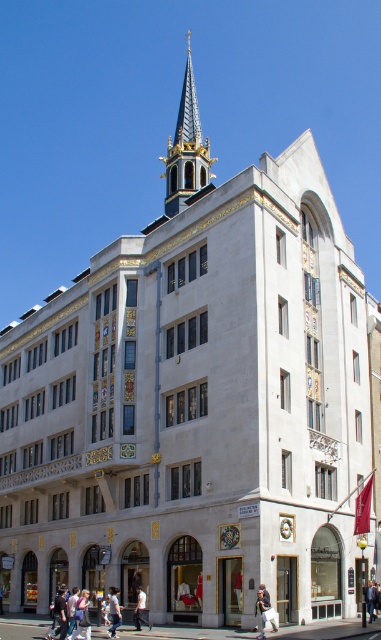
Question: Does gold textured clock at center have a smaller size compared to light brown leather jacket at lower center?

Choices:
 (A) no
 (B) yes

Answer: (B)

Question: Is light brown leather jacket at lower left to the right of light blue jeans at lower right from the viewer's perspective?

Choices:
 (A) no
 (B) yes

Answer: (A)

Question: Which object is the closest to the white cotton pants at lower right?

Choices:
 (A) light blue jeans at lower right
 (B) white matte shirt at center
 (C) gold textured clock at center
 (D) gold-plated spire at upper center

Answer: (C)

Question: Which point is closer to the camera?

Choices:
 (A) light brown leather jacket at lower left
 (B) gold-plated spire at upper center

Answer: (A)

Question: Can you confirm if gold-plated spire at upper center is thinner than light blue jeans at lower center?

Choices:
 (A) yes
 (B) no

Answer: (B)

Question: Which object is positioned farthest from the gold-plated spire at upper center?

Choices:
 (A) gold textured clock at center
 (B) light blue jeans at lower center

Answer: (B)